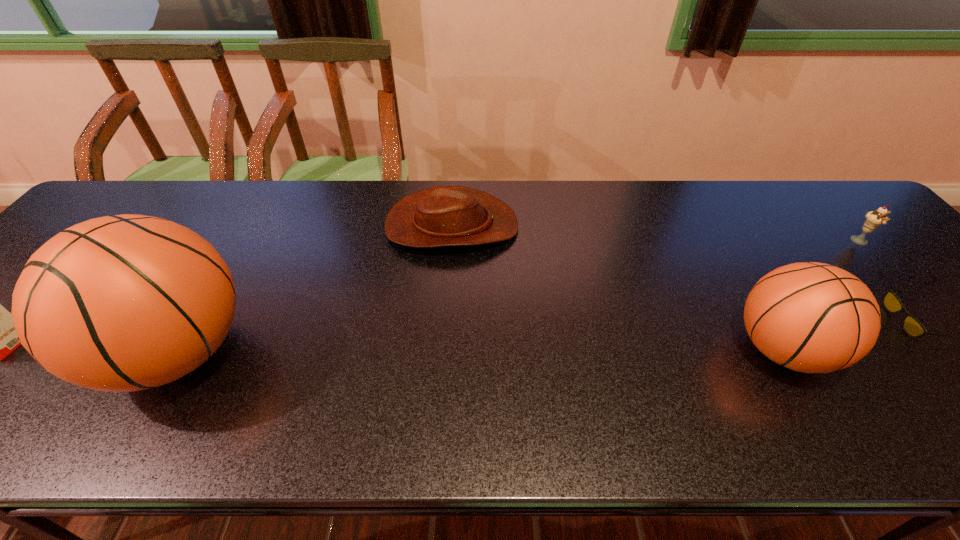
At what (x,y) coordinates should I click in order to perform the action: click on spot to insert another basketball for uniform distribution. Please return your answer as a coordinate pair (x, y). The height and width of the screenshot is (540, 960). Looking at the image, I should click on (481, 351).